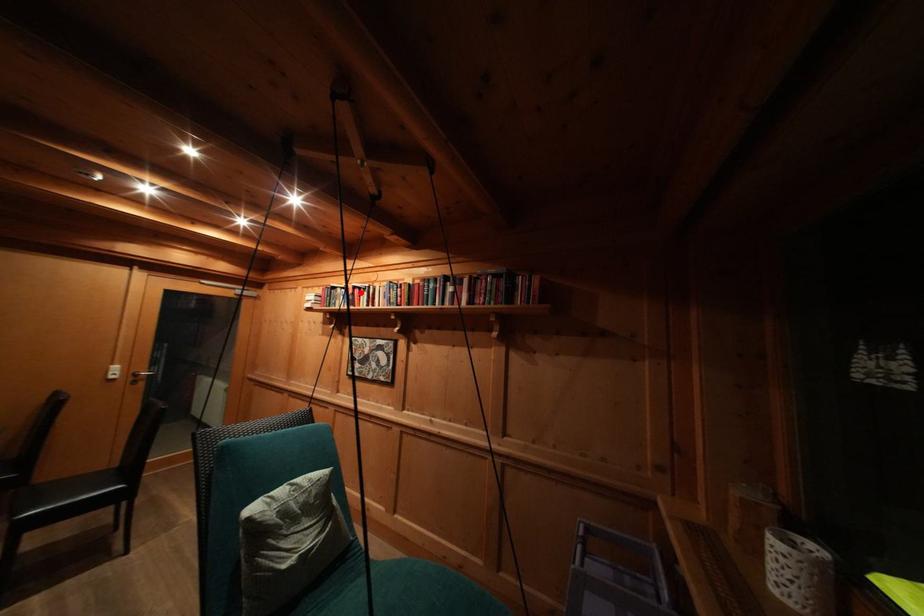
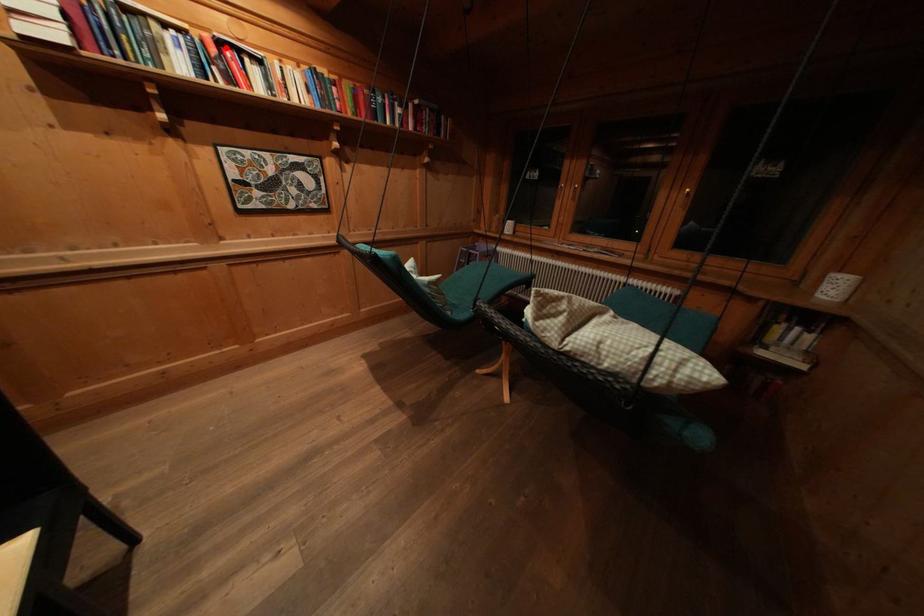
I am providing you with two images of the same scene from different viewpoints. A red point is marked on the first image and another point is marked on the second image. Is the marked point in image1 the same physical position as the marked point in image2?

Yes